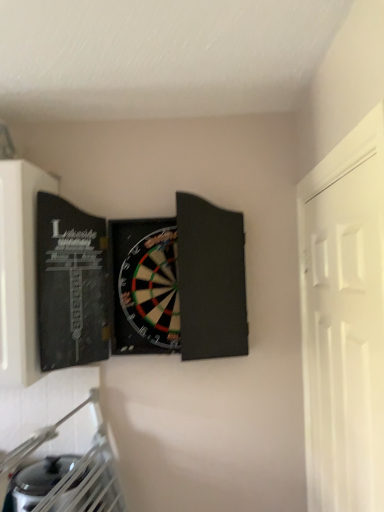
Question: Relative to white matte door at right, is black matte dartboard at center in front or behind?

Choices:
 (A) behind
 (B) front

Answer: (A)

Question: From a real-world perspective, is black matte dartboard at center positioned above or below white matte door at right?

Choices:
 (A) below
 (B) above

Answer: (B)

Question: From the image's perspective, is black matte dartboard at center located above or below white matte door at right?

Choices:
 (A) below
 (B) above

Answer: (B)

Question: Choose the correct answer: Is white matte door at right inside black matte dartboard at center or outside it?

Choices:
 (A) outside
 (B) inside

Answer: (A)

Question: From a real-world perspective, is white matte door at right positioned above or below black matte dartboard at center?

Choices:
 (A) above
 (B) below

Answer: (B)

Question: Based on their sizes in the image, would you say white matte door at right is bigger or smaller than black matte dartboard at center?

Choices:
 (A) big
 (B) small

Answer: (B)

Question: Considering the positions of white matte door at right and black matte dartboard at center in the image, is white matte door at right wider or thinner than black matte dartboard at center?

Choices:
 (A) wide
 (B) thin

Answer: (B)